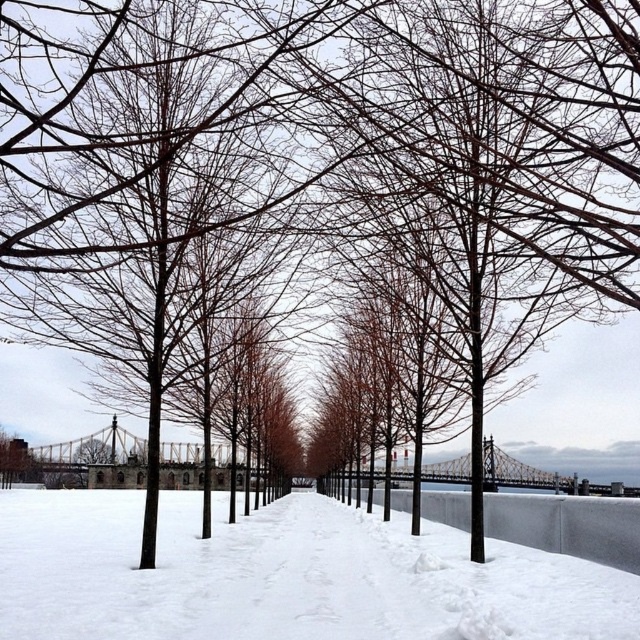
Question: Which point appears farthest from the camera in this image?

Choices:
 (A) (484, 96)
 (B) (218, 518)

Answer: (B)

Question: Is brown matte tree at center bigger than white snow at center?

Choices:
 (A) no
 (B) yes

Answer: (A)

Question: Which object is farther from the camera taking this photo?

Choices:
 (A) brown matte tree at center
 (B) white snow at center

Answer: (B)

Question: Is brown matte tree at center bigger than white snow at center?

Choices:
 (A) no
 (B) yes

Answer: (A)

Question: Which of the following is the closest to the observer?

Choices:
 (A) 365,595
 (B) 547,4

Answer: (B)

Question: Does brown matte tree at center appear under white snow at center?

Choices:
 (A) yes
 (B) no

Answer: (B)